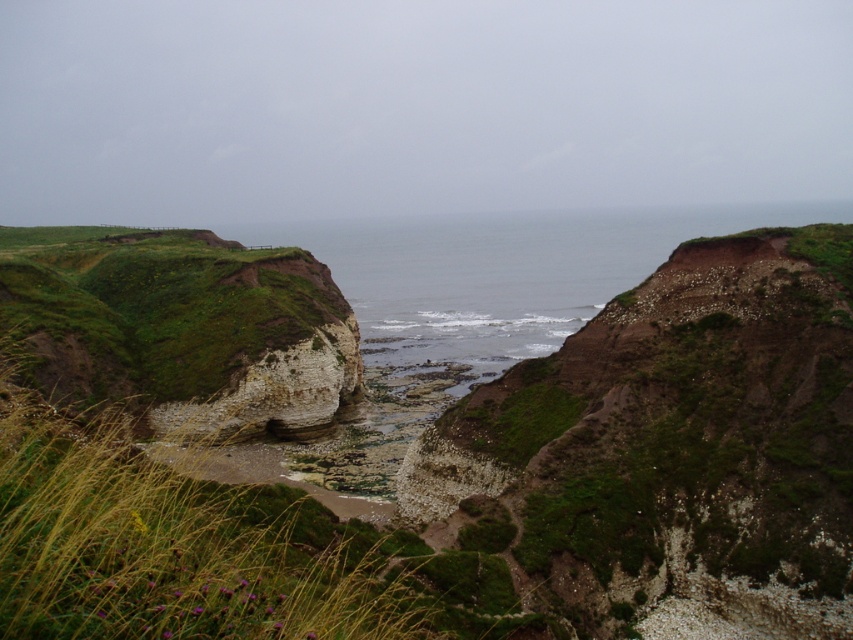
Question: Can you confirm if green mossy hillside at center is smaller than green mossy rock at left?

Choices:
 (A) yes
 (B) no

Answer: (A)

Question: Which of these objects is positioned closest to the green mossy hillside at center?

Choices:
 (A) white limestone cliff at center
 (B) green mossy rock at left

Answer: (A)

Question: Which point is closer to the camera?

Choices:
 (A) white limestone cliff at center
 (B) green mossy rock at left

Answer: (B)

Question: Is green mossy rock at left above white limestone cliff at center?

Choices:
 (A) yes
 (B) no

Answer: (A)

Question: Based on their relative distances, which object is farther from the green mossy hillside at center?

Choices:
 (A) white limestone cliff at center
 (B) green mossy rock at left

Answer: (B)

Question: Does green mossy hillside at center appear on the left side of white limestone cliff at center?

Choices:
 (A) yes
 (B) no

Answer: (B)